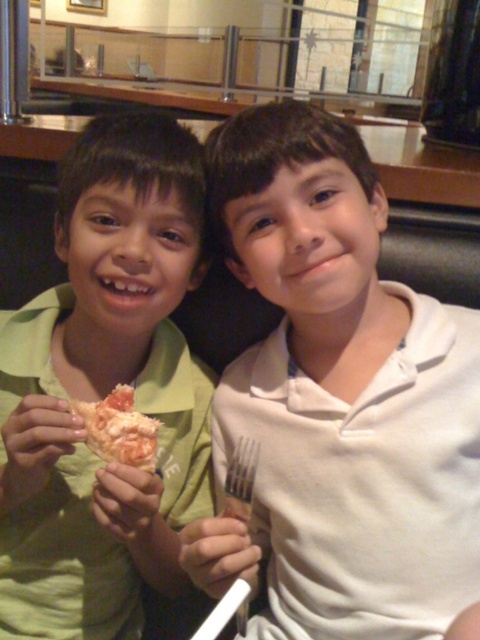
You are a delivery robot with a 15 cm wide tray. You need to place the shiny orange pizza slice at center onto the green matte shirt at left. Can your tray fit between them without moving either object?

The distance between the green matte shirt at left and the shiny orange pizza slice at center is 16.82 centimeters. Since your tray is 15 cm wide, it is narrower than the gap, so you can fit the tray between them without moving either object.

You are a waiter in a restaurant and need to place a drink on the table between the two boys. The table is represented by the coordinate system where the bottom left corner is the origin point. The white matte fork at right is located at point (338, 401). Where should you place the drink so it is equidistant from both boys?

To place the drink equidistant from both boys, position it at the midpoint between their positions. Since the white matte fork at right is at point (338, 401), the drink should be placed at the midpoint coordinates, which would be halfway between the two boys. However, without the exact coordinates of both boys, the exact midpoint can be calculated if the fork is a reference point. Assuming the fork is near the right boy, the drink should be placed at 0.628 divided by 2, resulting in 0.314, 0.353. But due